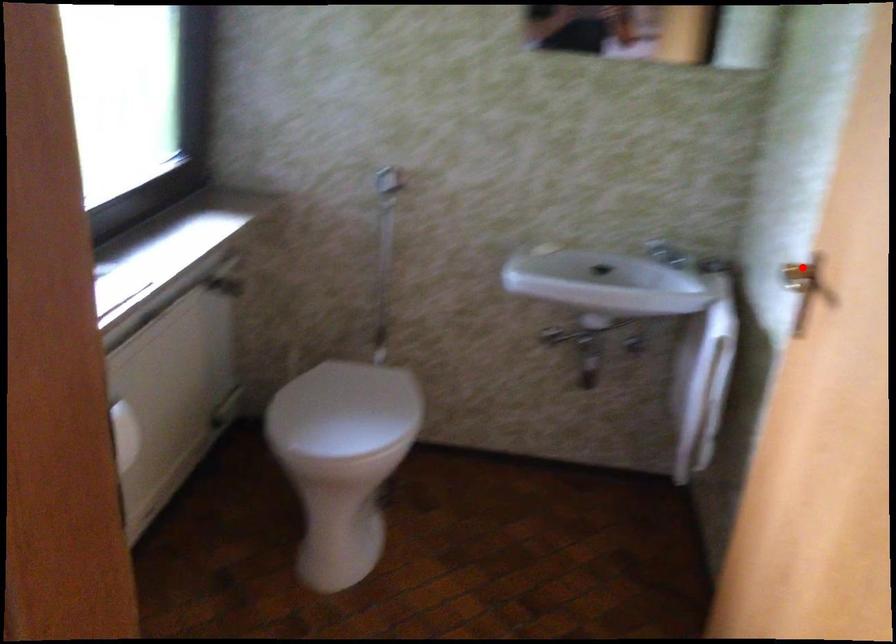
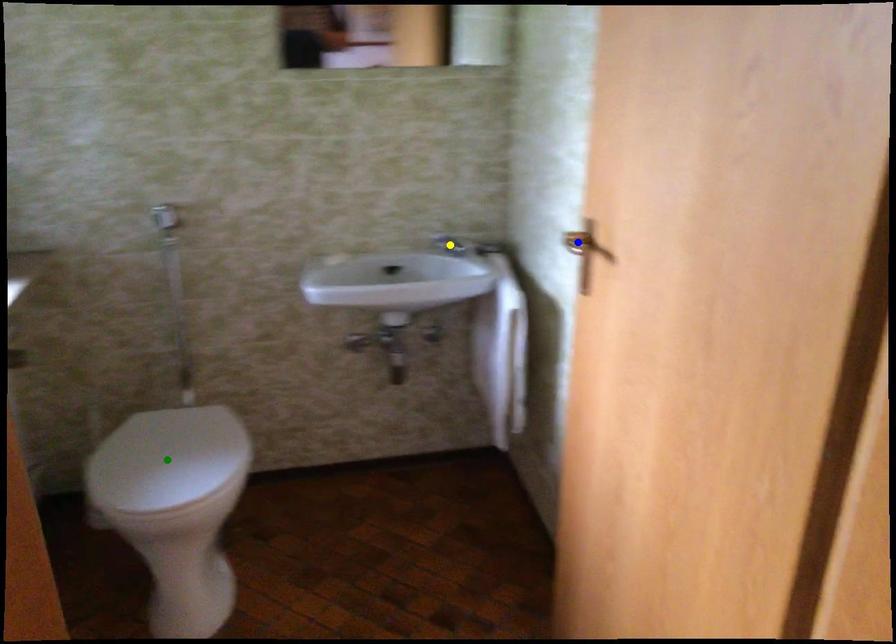
Question: I am providing you with two images of the same scene from different viewpoints. A red point is marked on the first image. You are given multiple points on the second image. In image 2, which mark is for the same physical point as the one in image 1?

Choices:
 (A) green point
 (B) blue point
 (C) yellow point

Answer: (B)